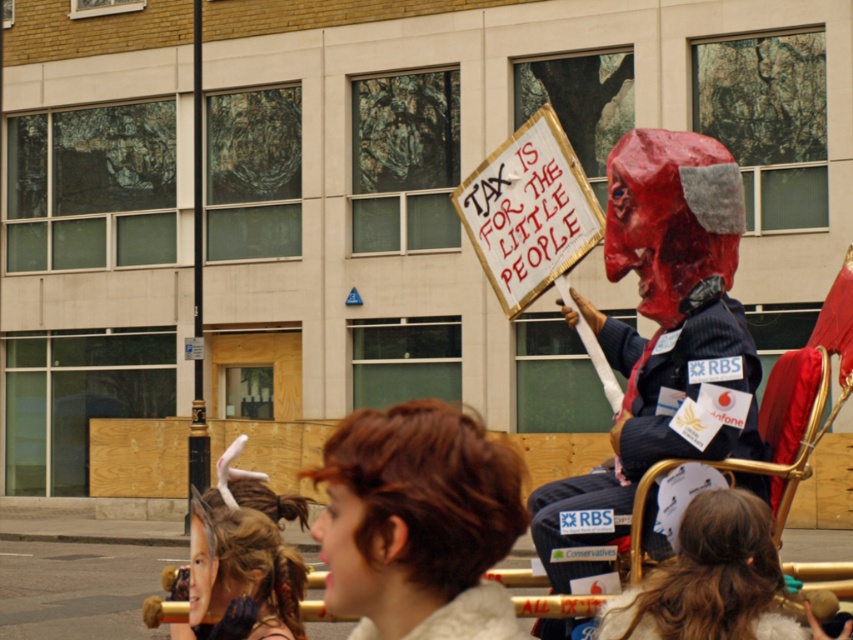
Question: Which object appears closest to the camera in this image?

Choices:
 (A) shiny gold hair at lower left
 (B) brown fur coat at center

Answer: (B)

Question: Which point is farther from the camera taking this photo?

Choices:
 (A) (264, 538)
 (B) (676, 248)

Answer: (B)

Question: From the image, what is the correct spatial relationship of brown hair at center in relation to shiny gold hair at lower left?

Choices:
 (A) above
 (B) below

Answer: (B)

Question: Is brown hair at center behind brown fur coat at center?

Choices:
 (A) no
 (B) yes

Answer: (A)

Question: Among these objects, which one is farthest from the camera?

Choices:
 (A) brown fur coat at center
 (B) shiny gold hair at lower left
 (C) brown hair at center

Answer: (B)

Question: Can you confirm if brown hair at center is positioned to the right of shiny gold hair at lower left?

Choices:
 (A) yes
 (B) no

Answer: (B)